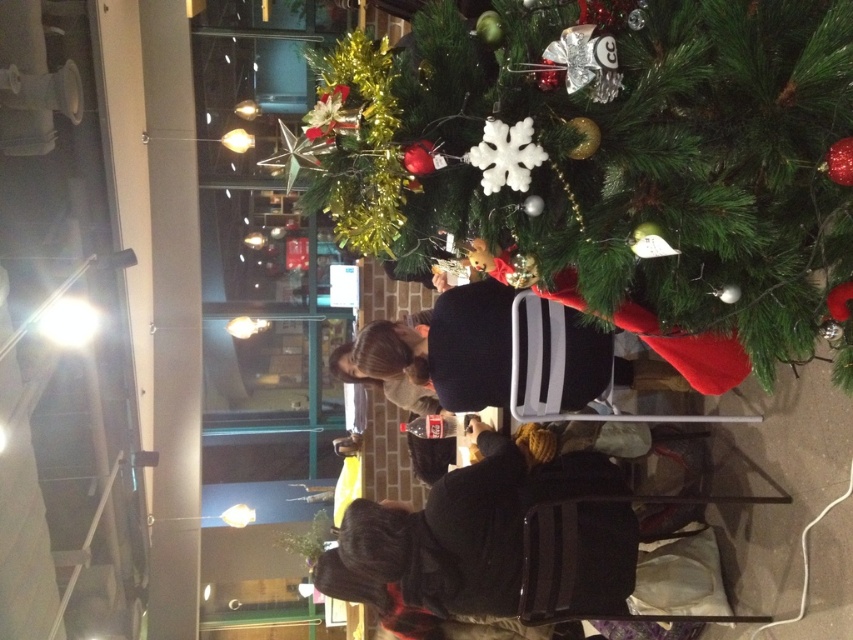
You are standing at the entrance of the room and want to find the green matte christmas tree at center. According to the coordinates provided, in which direction should you move to reach it?

The green matte christmas tree at center is located at coordinates point (618, 154), so you should move towards the lower right direction from the entrance to reach it.

You are a delivery person carrying a box that is 80 centimeters wide. You need to place the box between the green matte christmas tree at center and the dark brown sweater at center. Is there enough space between them to fit the box?

The green matte christmas tree at center and dark brown sweater at center are 76.89 centimeters apart. Since the box is 80 centimeters wide, it is slightly wider than the available space between them. Therefore, the box cannot fit between the green matte christmas tree at center and the dark brown sweater at center.

You are a guest at the Christmas event and want to take a photo of the dark brown sweater at center and the green matte christmas tree at center. Based on their positions, which object should you focus on first to ensure both are in the frame?

You should focus on the dark brown sweater at center first because the green matte christmas tree at center is to the right of it, so by centering the sweater, the tree will naturally be in the frame to its right.